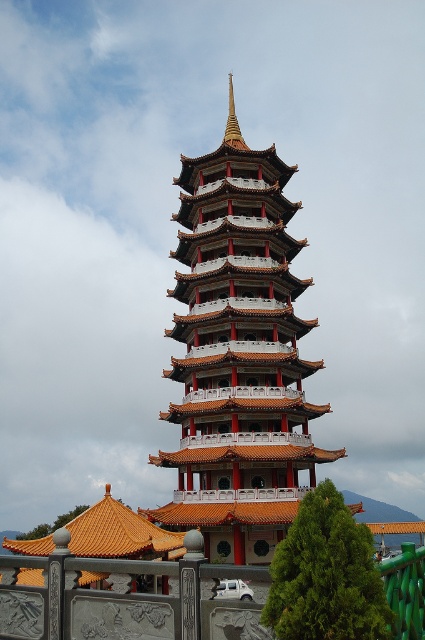
You are standing in front of the pagoda and want to reach both the point at coordinates point (x=215, y=419) and the point at coordinates point (x=27, y=634). Which point will you reach first as you walk towards them?

You will reach point (x=215, y=419) first because it is closer to you than point (x=27, y=634), which is further away.

You are standing in front of the pagoda and want to take a photo that includes both the orange glazed tile tower at center and the gold polished spire at center. Which object should you focus on first to ensure both are in frame?

You should focus on the orange glazed tile tower at center first because it is closer to you than the gold polished spire at center, so adjusting the camera to include it will naturally include the spire as well.

You are a photographer planning to capture the pagoda from a specific angle. You need to ensure that the gray stone railing at lower center does not block the view of the gold polished spire at center. Based on their widths, can you determine if the railing will obscure the spire?

The gray stone railing at lower center might be wider than gold polished spire at center, so there is a possibility that the railing could block the view of the spire depending on their exact positions and angles.